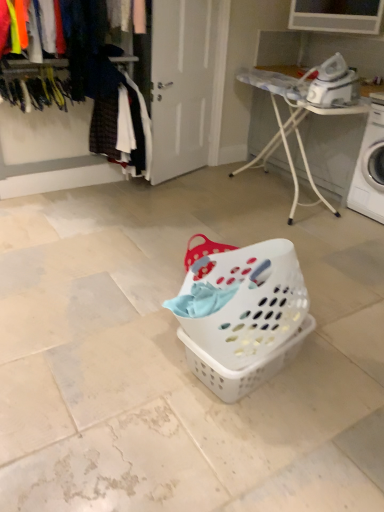
Question: Does plaid fabric shirt at left appear on the right side of white plastic ironing board at upper right?

Choices:
 (A) yes
 (B) no

Answer: (B)

Question: From a real-world perspective, is plaid fabric shirt at left below white plastic ironing board at upper right?

Choices:
 (A) no
 (B) yes

Answer: (A)

Question: Is plaid fabric shirt at left further to the viewer compared to white plastic ironing board at upper right?

Choices:
 (A) yes
 (B) no

Answer: (A)

Question: Is plaid fabric shirt at left beside white plastic ironing board at upper right?

Choices:
 (A) yes
 (B) no

Answer: (B)

Question: Considering the relative sizes of plaid fabric shirt at left and white plastic ironing board at upper right in the image provided, is plaid fabric shirt at left shorter than white plastic ironing board at upper right?

Choices:
 (A) no
 (B) yes

Answer: (B)

Question: Is white plastic ironing board at upper right completely or partially inside plaid fabric shirt at left?

Choices:
 (A) no
 (B) yes

Answer: (A)

Question: Is the surface of white plastic laundry basket at center in direct contact with white plastic washing machine at right?

Choices:
 (A) yes
 (B) no

Answer: (B)

Question: Is white plastic laundry basket at center completely or partially outside of white plastic washing machine at right?

Choices:
 (A) yes
 (B) no

Answer: (A)

Question: From the image's perspective, is white plastic laundry basket at center located above white plastic washing machine at right?

Choices:
 (A) yes
 (B) no

Answer: (B)

Question: Is white plastic laundry basket at center wider than white plastic washing machine at right?

Choices:
 (A) no
 (B) yes

Answer: (A)

Question: From a real-world perspective, is white plastic laundry basket at center over white plastic washing machine at right?

Choices:
 (A) yes
 (B) no

Answer: (B)

Question: Considering the relative positions of white plastic laundry basket at center and white plastic washing machine at right in the image provided, is white plastic laundry basket at center to the left of white plastic washing machine at right from the viewer's perspective?

Choices:
 (A) yes
 (B) no

Answer: (A)

Question: Is white plastic washing machine at right turned away from white plastic ironing board at upper right?

Choices:
 (A) yes
 (B) no

Answer: (A)